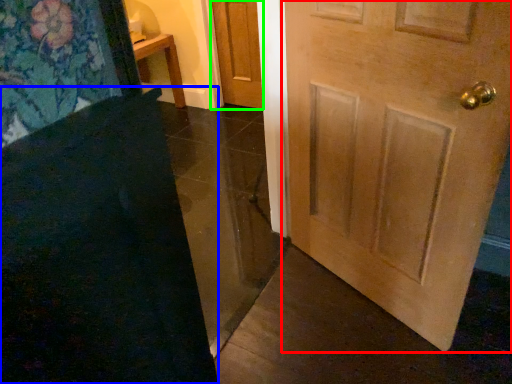
Question: Which object is positioned farthest from door (highlighted by a red box)? Select from doormat (highlighted by a blue box) and door (highlighted by a green box).

Choices:
 (A) doormat
 (B) door

Answer: (B)